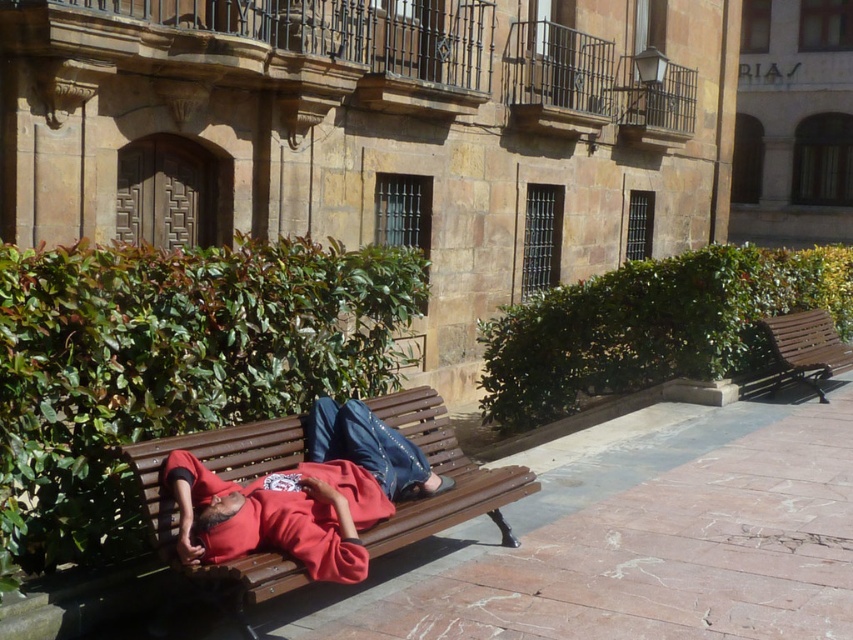
You are designing a seating arrangement for a public square and need to place two benches. The brown wooden bench at center and the wooden bench at right are available. Which bench should you choose if you want to accommodate more people sitting side by side?

The wooden bench at right has a greater width than the brown wooden bench at center, so it can accommodate more people sitting side by side.